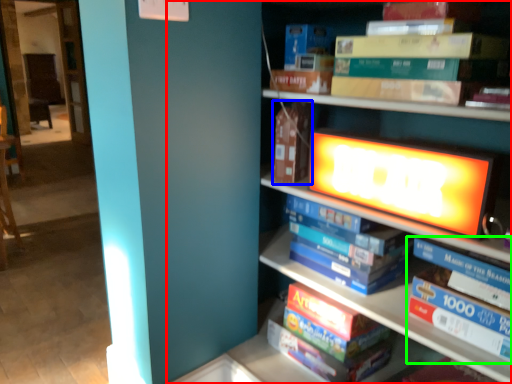
Question: Based on their relative distances, which object is nearer to bookcase (highlighted by a red box)? Choose from paperback book (highlighted by a blue box) and book (highlighted by a green box).

Choices:
 (A) paperback book
 (B) book

Answer: (A)